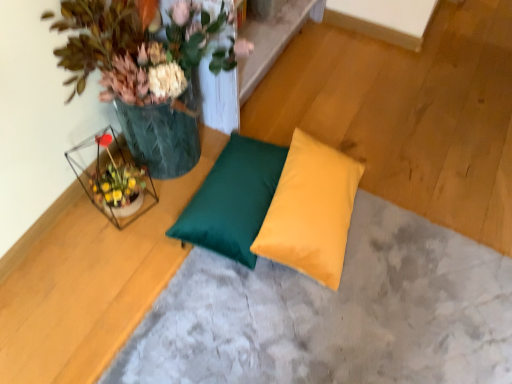
What do you see at coordinates (141, 66) in the screenshot?
I see `green leafy plant at upper left` at bounding box center [141, 66].

Describe the element at coordinates (233, 199) in the screenshot. This screenshot has height=384, width=512. I see `satin green pillow at center, which is the 1th pillow in left-to-right order` at that location.

The height and width of the screenshot is (384, 512). Describe the element at coordinates (311, 210) in the screenshot. I see `yellow satin pillow at center, the first pillow viewed from the right` at that location.

You are a GUI agent. You are given a task and a screenshot of the screen. Output one action in this format:
    pyautogui.click(x=<x>, y=<y>)
    Task: Click on the green leafy plant at upper left
    
    Given the screenshot: What is the action you would take?
    pyautogui.click(x=141, y=66)

Considering the points (209, 188) and (55, 22), which point is in front, point (209, 188) or point (55, 22)?

The point (55, 22) is in front.

Considering their positions, is satin green pillow at center, which is the 1th pillow in left-to-right order, located in front of or behind green leafy plant at upper left?

Visually, satin green pillow at center, which is the 1th pillow in left-to-right order, is located behind green leafy plant at upper left.

The height and width of the screenshot is (384, 512). Identify the location of houseplant located on the left of satin green pillow at center, which is the 1th pillow in left-to-right order. (141, 66).

From the image's perspective, which one is positioned lower, satin green pillow at center, which is the 1th pillow in left-to-right order, or green leafy plant at upper left?

From the image's view, satin green pillow at center, which is the 1th pillow in left-to-right order, is below.

Is matte green pillow at center in contact with satin green pillow at center, the 2th pillow viewed from the right?

No, matte green pillow at center is not making contact with satin green pillow at center, the 2th pillow viewed from the right.

Can you confirm if matte green pillow at center is taller than satin green pillow at center, which is the 1th pillow in left-to-right order?

No, matte green pillow at center is not taller than satin green pillow at center, which is the 1th pillow in left-to-right order.

Who is bigger, matte green pillow at center or satin green pillow at center, the 2th pillow viewed from the right?

With larger size is matte green pillow at center.

From the image's perspective, is green leafy plant at upper left on satin green pillow at center, which is the 1th pillow in left-to-right order?

Indeed, from the image's perspective, green leafy plant at upper left is shown above satin green pillow at center, which is the 1th pillow in left-to-right order.

Is satin green pillow at center, which is the 1th pillow in left-to-right order, a part of green leafy plant at upper left?

No, satin green pillow at center, which is the 1th pillow in left-to-right order, is not surrounded by green leafy plant at upper left.

Is green leafy plant at upper left bigger or smaller than satin green pillow at center, which is the 1th pillow in left-to-right order?

green leafy plant at upper left is bigger than satin green pillow at center, which is the 1th pillow in left-to-right order.

Measure the distance between green leafy plant at upper left and satin green pillow at center, the 2th pillow viewed from the right.

They are 33.43 centimeters apart.

Which point is more forward, (318, 203) or (309, 327)?

Positioned in front is point (309, 327).

Is yellow satin pillow at center, marked as the second pillow in a left-to-right arrangement, smaller than matte green pillow at center?

Yes.

Is yellow satin pillow at center, the first pillow viewed from the right, not close to matte green pillow at center?

Actually, yellow satin pillow at center, the first pillow viewed from the right, and matte green pillow at center are a little close together.

From a real-world perspective, who is located higher, green leafy plant at upper left or matte green pillow at center?

From a 3D spatial view, green leafy plant at upper left is above.

Is green leafy plant at upper left turned away from matte green pillow at center?

green leafy plant at upper left is not turned away from matte green pillow at center.

Can you confirm if green leafy plant at upper left is thinner than matte green pillow at center?

Yes.

I want to click on concrete located below the green leafy plant at upper left (from the image's perspective), so point(335,314).

Can yellow satin pillow at center, the first pillow viewed from the right, be found inside satin green pillow at center, the 2th pillow viewed from the right?

No, yellow satin pillow at center, the first pillow viewed from the right, is not a part of satin green pillow at center, the 2th pillow viewed from the right.

Is the depth of satin green pillow at center, the 2th pillow viewed from the right, greater than that of yellow satin pillow at center, the first pillow viewed from the right?

Yes, the depth of satin green pillow at center, the 2th pillow viewed from the right, is greater than that of yellow satin pillow at center, the first pillow viewed from the right.

Between point (240, 261) and point (320, 146), which one is positioned in front?

The point (240, 261) is in front.

Looking at the image, does satin green pillow at center, the 2th pillow viewed from the right, seem bigger or smaller compared to yellow satin pillow at center, marked as the second pillow in a left-to-right arrangement?

Clearly, satin green pillow at center, the 2th pillow viewed from the right, is smaller in size than yellow satin pillow at center, marked as the second pillow in a left-to-right arrangement.

Is matte green pillow at center smaller than yellow satin pillow at center, the first pillow viewed from the right?

Incorrect, matte green pillow at center is not smaller in size than yellow satin pillow at center, the first pillow viewed from the right.

Can you tell me how much matte green pillow at center and yellow satin pillow at center, the first pillow viewed from the right, differ in facing direction?

6.86 degrees.

Does matte green pillow at center touch yellow satin pillow at center, marked as the second pillow in a left-to-right arrangement?

No.

What are the coordinates of `houseplant above the satin green pillow at center, the 2th pillow viewed from the right (from a real-world perspective)` in the screenshot? It's located at (141, 66).

This screenshot has width=512, height=384. Identify the location of the 2nd pillow behind the matte green pillow at center, counting from the anchor's position. (233, 199).

Which object lies nearer to the anchor point green leafy plant at upper left, yellow satin pillow at center, marked as the second pillow in a left-to-right arrangement, or satin green pillow at center, the 2th pillow viewed from the right?

The object closer to green leafy plant at upper left is satin green pillow at center, the 2th pillow viewed from the right.

From the image, which object appears to be farther from yellow satin pillow at center, the first pillow viewed from the right, green leafy plant at upper left or satin green pillow at center, the 2th pillow viewed from the right?

The object further to yellow satin pillow at center, the first pillow viewed from the right, is green leafy plant at upper left.

When comparing their distances from matte green pillow at center, does yellow satin pillow at center, marked as the second pillow in a left-to-right arrangement, or green leafy plant at upper left seem further?

Based on the image, green leafy plant at upper left appears to be further to matte green pillow at center.

Based on their spatial positions, is satin green pillow at center, which is the 1th pillow in left-to-right order, or matte green pillow at center further from yellow satin pillow at center, the first pillow viewed from the right?

matte green pillow at center.

When comparing their distances from satin green pillow at center, which is the 1th pillow in left-to-right order, does matte green pillow at center or green leafy plant at upper left seem closer?

matte green pillow at center is positioned closer to the anchor satin green pillow at center, which is the 1th pillow in left-to-right order.

From the picture: When comparing their distances from satin green pillow at center, which is the 1th pillow in left-to-right order, does green leafy plant at upper left or yellow satin pillow at center, the first pillow viewed from the right, seem further?

green leafy plant at upper left is positioned further to the anchor satin green pillow at center, which is the 1th pillow in left-to-right order.

Based on their spatial positions, is matte green pillow at center or yellow satin pillow at center, the first pillow viewed from the right, closer to green leafy plant at upper left?

Among the two, yellow satin pillow at center, the first pillow viewed from the right, is located nearer to green leafy plant at upper left.

Looking at the image, which one is located further to yellow satin pillow at center, the first pillow viewed from the right, satin green pillow at center, the 2th pillow viewed from the right, or green leafy plant at upper left?

green leafy plant at upper left is further to yellow satin pillow at center, the first pillow viewed from the right.

Locate an element on the screen. pillow between satin green pillow at center, which is the 1th pillow in left-to-right order, and matte green pillow at center in the up-down direction is located at coordinates (311, 210).

The image size is (512, 384). Find the location of `pillow between green leafy plant at upper left and yellow satin pillow at center, marked as the second pillow in a left-to-right arrangement, from left to right`. pillow between green leafy plant at upper left and yellow satin pillow at center, marked as the second pillow in a left-to-right arrangement, from left to right is located at coordinates (233, 199).